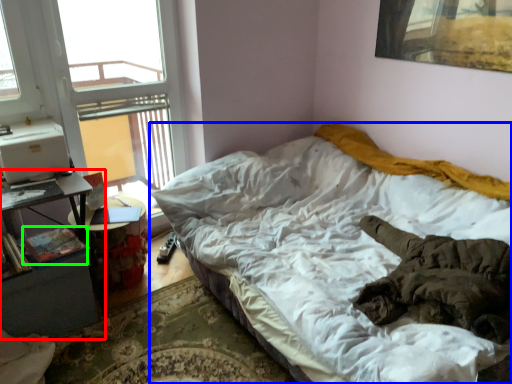
Question: Which object is the closest to the nightstand (highlighted by a red box)? Choose among these: bed (highlighted by a blue box) or book (highlighted by a green box).

Choices:
 (A) bed
 (B) book

Answer: (B)